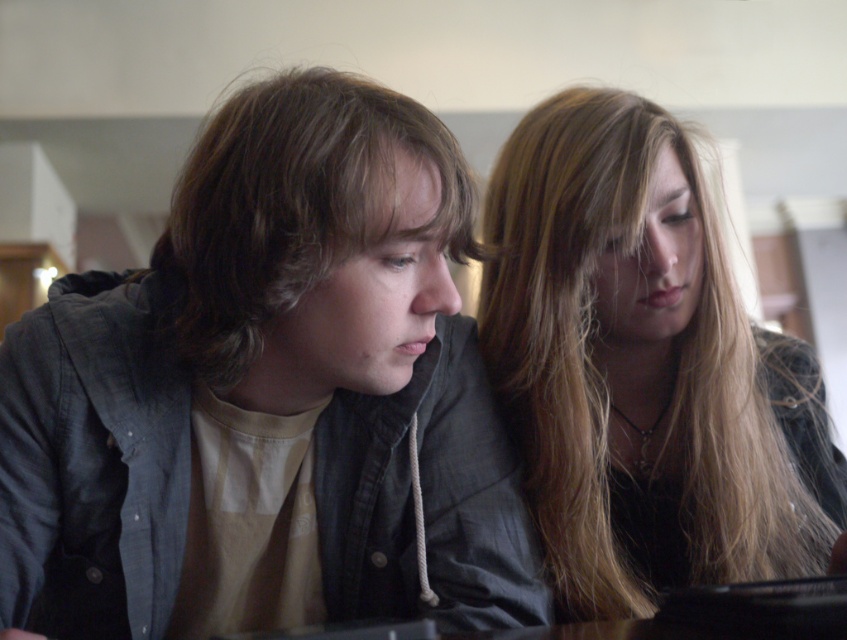
Which is behind, point (634, 304) or point (228, 157)?

Positioned behind is point (634, 304).

What do you see at coordinates (645, 368) in the screenshot?
I see `smooth black hair at center` at bounding box center [645, 368].

Where is `smooth black hair at center`? The width and height of the screenshot is (847, 640). smooth black hair at center is located at coordinates (645, 368).

Locate an element on the screen. This screenshot has height=640, width=847. smooth black hair at center is located at coordinates (645, 368).

Which is behind, point (7, 374) or point (512, 324)?

Positioned behind is point (512, 324).

This screenshot has width=847, height=640. Identify the location of matte gray jacket at center. (267, 396).

Who is lower down, matte gray jacket at center or brownhair at center?

matte gray jacket at center

Does point (162, 579) come in front of point (244, 196)?

No.

Find the location of a particular element. This screenshot has width=847, height=640. matte gray jacket at center is located at coordinates (267, 396).

Locate an element on the screen. The height and width of the screenshot is (640, 847). matte gray jacket at center is located at coordinates (267, 396).